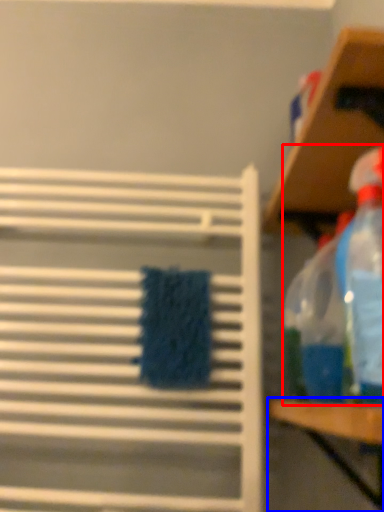
Question: Which of the following is the farthest to the observer, cleaning product (highlighted by a red box) or table (highlighted by a blue box)?

Choices:
 (A) cleaning product
 (B) table

Answer: (A)